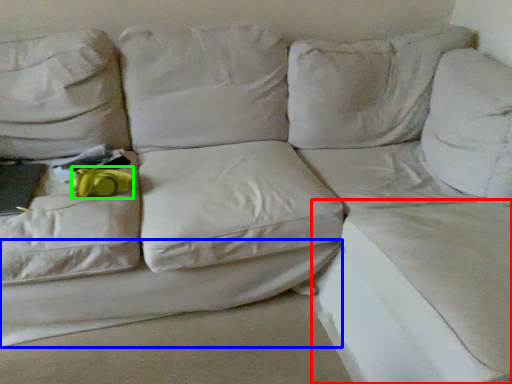
Question: Which object is positioned closest to sheet (highlighted by a red box)? Select from sheet (highlighted by a blue box) and stuff (highlighted by a green box).

Choices:
 (A) sheet
 (B) stuff

Answer: (A)